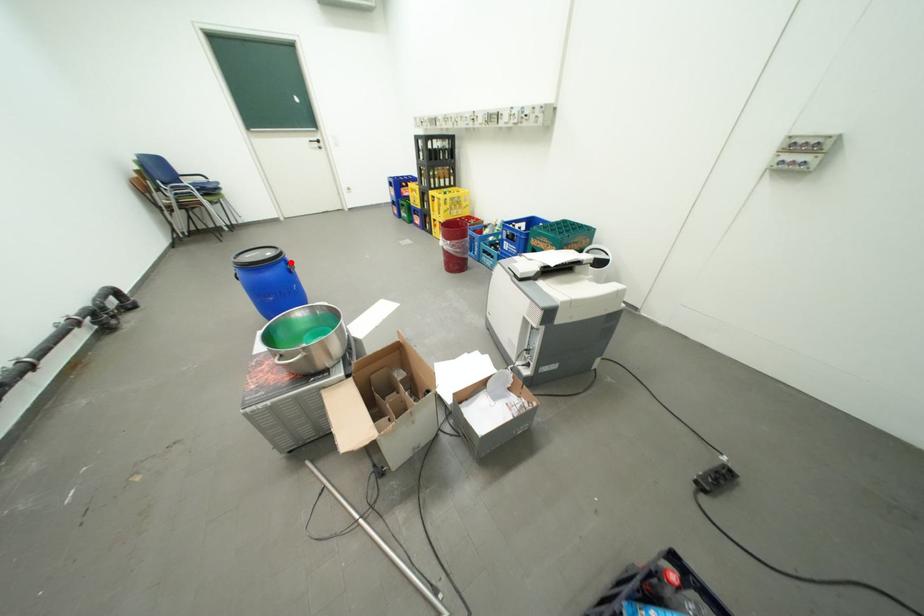
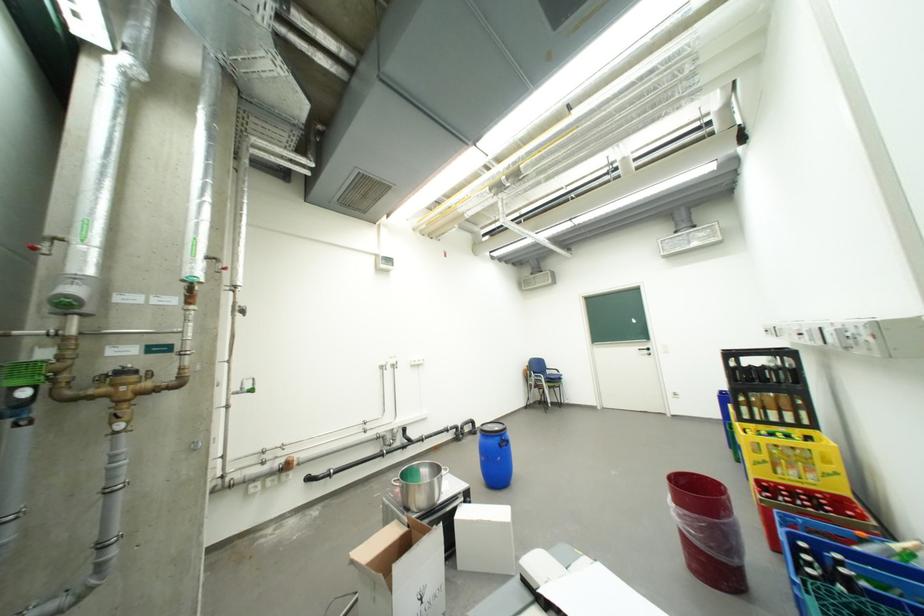
Question: I am providing you with two images of the same scene from different viewpoints. In image1, a red point is highlighted. Considering the same 3D point in image2, which of the following is correct?

Choices:
 (A) It is closer
 (B) It is farther

Answer: (B)